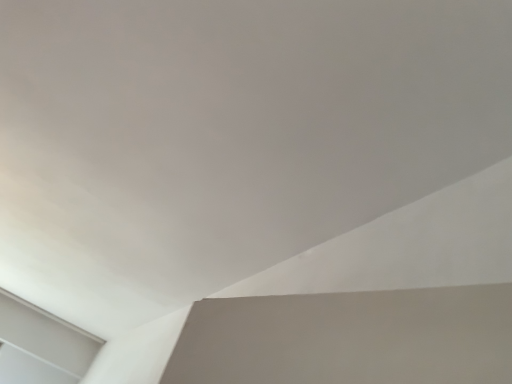
Describe the element at coordinates (40, 346) in the screenshot. I see `white plastic window at lower left` at that location.

I want to click on white plastic window at lower left, so click(40, 346).

Identify the location of white plastic window at lower left. (40, 346).